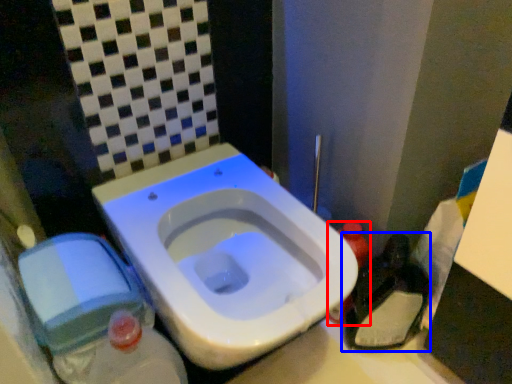
Question: Which of the following is the farthest to the observer, bottle (highlighted by a red box) or garbage (highlighted by a blue box)?

Choices:
 (A) bottle
 (B) garbage

Answer: (A)